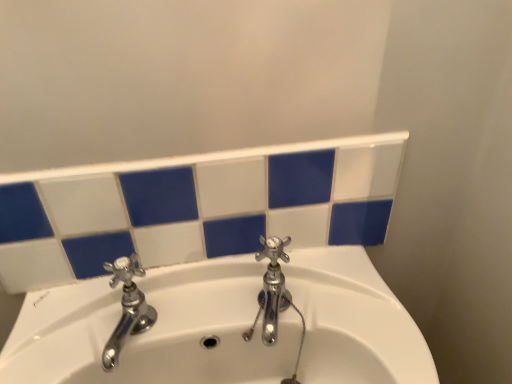
Question: Are polished chrome faucet at left, which is the 2th tap from right to left, and chrome metallic faucet at center, the second tap viewed from the left, making contact?

Choices:
 (A) yes
 (B) no

Answer: (B)

Question: Is polished chrome faucet at left, which is the 2th tap from right to left, taller than chrome metallic faucet at center, the second tap viewed from the left?

Choices:
 (A) yes
 (B) no

Answer: (B)

Question: Is polished chrome faucet at left, which is the 2th tap from right to left, to the right of chrome metallic faucet at center, which is counted as the 1th tap, starting from the right, from the viewer's perspective?

Choices:
 (A) yes
 (B) no

Answer: (B)

Question: From a real-world perspective, is polished chrome faucet at left, which is the 1th tap in left-to-right order, below chrome metallic faucet at center, which is counted as the 1th tap, starting from the right?

Choices:
 (A) yes
 (B) no

Answer: (B)

Question: Is polished chrome faucet at left, which is the 2th tap from right to left, shorter than chrome metallic faucet at center, which is counted as the 1th tap, starting from the right?

Choices:
 (A) yes
 (B) no

Answer: (A)

Question: Would you say chrome metallic faucet at center, which is counted as the 1th tap, starting from the right, is part of polished chrome faucet at left, which is the 2th tap from right to left,'s contents?

Choices:
 (A) yes
 (B) no

Answer: (B)

Question: Is polished chrome faucet at left, which is the 2th tap from right to left, inside chrome metallic faucet at center, which is counted as the 1th tap, starting from the right?

Choices:
 (A) no
 (B) yes

Answer: (A)

Question: From the image's perspective, is chrome metallic faucet at center, the second tap viewed from the left, under polished chrome faucet at left, which is the 1th tap in left-to-right order?

Choices:
 (A) yes
 (B) no

Answer: (B)

Question: Is chrome metallic faucet at center, the second tap viewed from the left, to the left of polished chrome faucet at left, which is the 2th tap from right to left, from the viewer's perspective?

Choices:
 (A) yes
 (B) no

Answer: (B)

Question: Can you confirm if chrome metallic faucet at center, the second tap viewed from the left, is positioned to the right of polished chrome faucet at left, which is the 2th tap from right to left?

Choices:
 (A) yes
 (B) no

Answer: (A)

Question: Is the position of chrome metallic faucet at center, which is counted as the 1th tap, starting from the right, more distant than that of polished chrome faucet at left, which is the 1th tap in left-to-right order?

Choices:
 (A) no
 (B) yes

Answer: (B)

Question: Does chrome metallic faucet at center, which is counted as the 1th tap, starting from the right, have a lesser height compared to polished chrome faucet at left, which is the 1th tap in left-to-right order?

Choices:
 (A) yes
 (B) no

Answer: (B)

Question: From the image's perspective, is polished chrome faucet at left, which is the 1th tap in left-to-right order, positioned above or below chrome metallic faucet at center, which is counted as the 1th tap, starting from the right?

Choices:
 (A) below
 (B) above

Answer: (A)